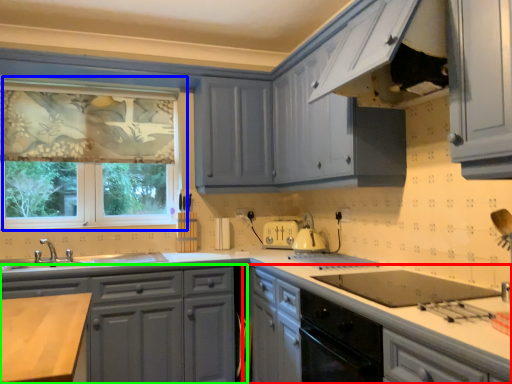
Question: Which object is the closest to the cabinetry (highlighted by a red box)? Choose among these: window (highlighted by a blue box) or cabinetry (highlighted by a green box).

Choices:
 (A) window
 (B) cabinetry

Answer: (B)